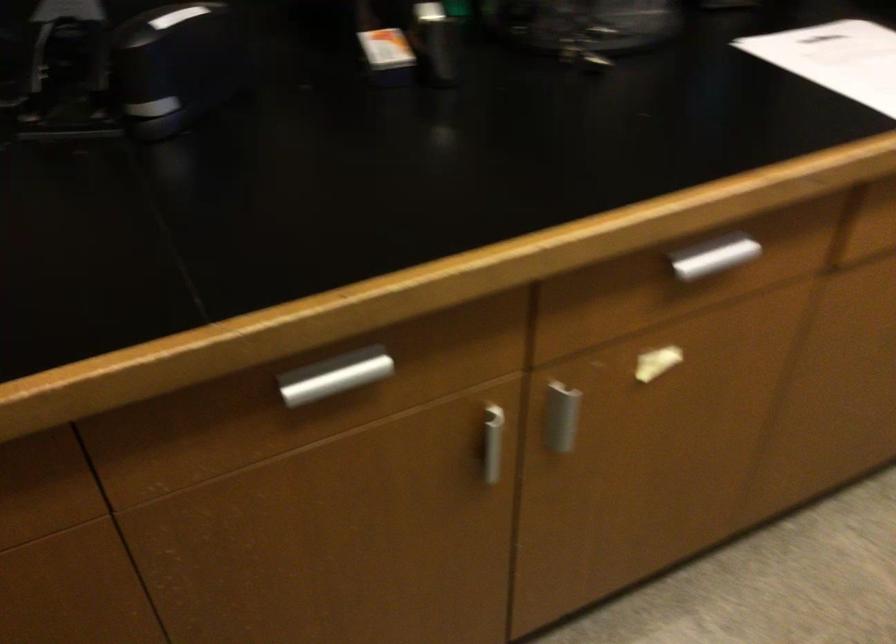
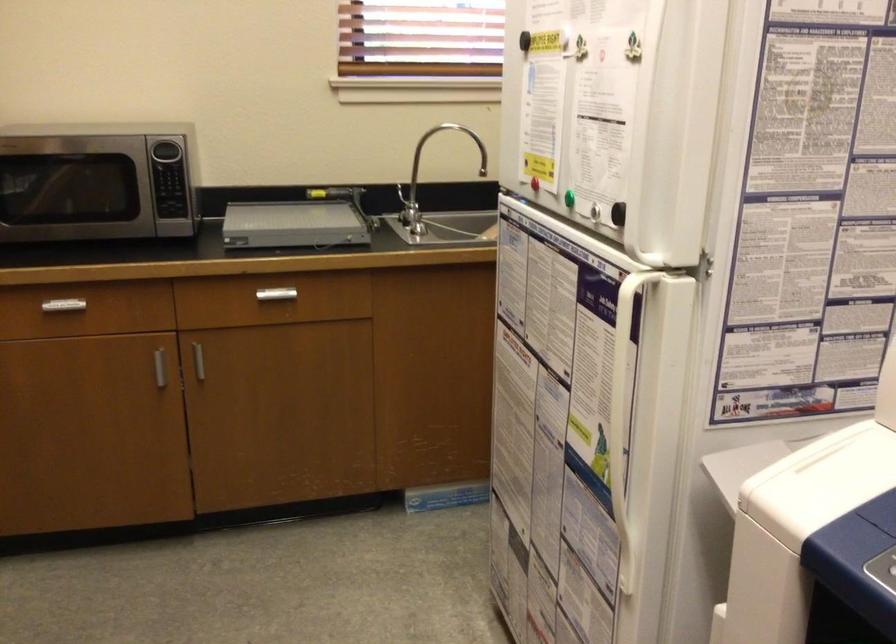
Question: The first image is from the beginning of the video and the second image is from the end. How did the camera likely rotate when shooting the video?

Choices:
 (A) Left
 (B) Right
 (C) Up
 (D) Down

Answer: (B)